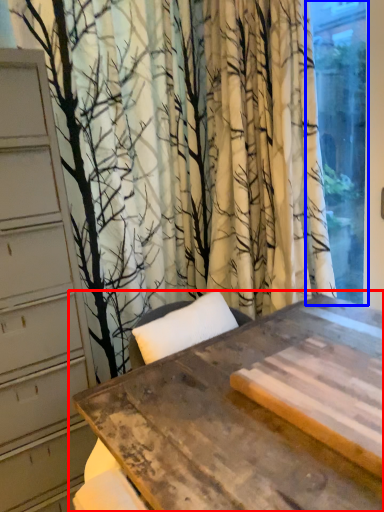
Question: Which object appears closest to the camera in this image, table (highlighted by a red box) or window (highlighted by a blue box)?

Choices:
 (A) table
 (B) window

Answer: (A)